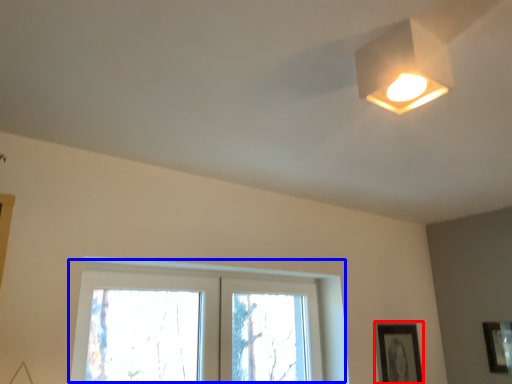
Question: Among these objects, which one is farthest to the camera, picture frame (highlighted by a red box) or window (highlighted by a blue box)?

Choices:
 (A) picture frame
 (B) window

Answer: (A)